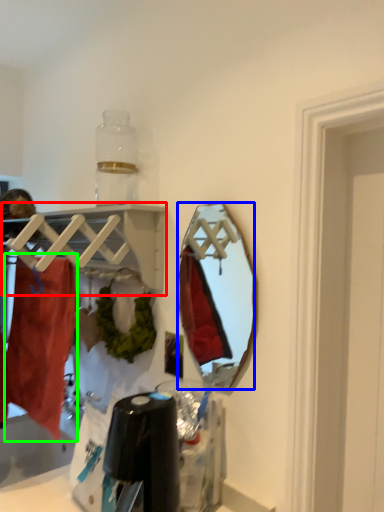
Question: Based on their relative distances, which object is nearer to shelf (highlighted by a red box)? Choose from mirror (highlighted by a blue box) and clothing (highlighted by a green box).

Choices:
 (A) mirror
 (B) clothing

Answer: (B)